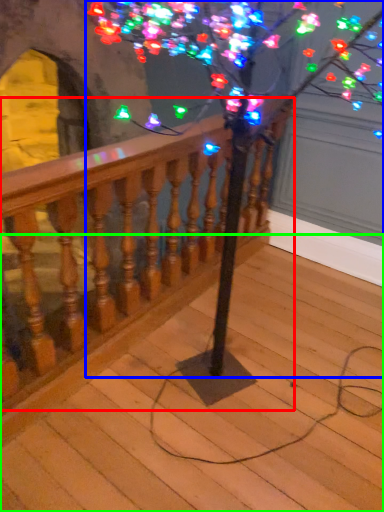
Question: Based on their relative distances, which object is farther from rail (highlighted by a red box)? Choose from tree (highlighted by a blue box) and stairs (highlighted by a green box).

Choices:
 (A) tree
 (B) stairs

Answer: (B)